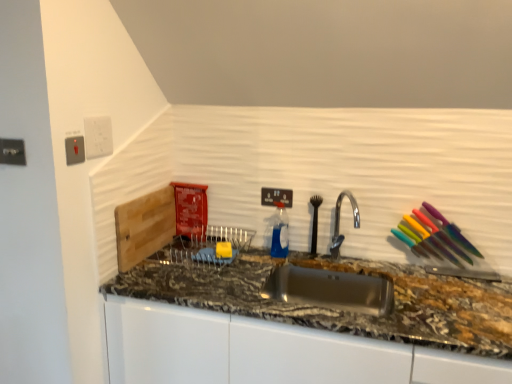
Question: Looking at the image, does satin silver switch at upper left, placed as the third electric outlet when sorted from right to left, seem bigger or smaller compared to white plastic electric outlet at upper left, which is the 3th electric outlet in left-to-right order?

Choices:
 (A) small
 (B) big

Answer: (A)

Question: Would you say satin silver switch at upper left, the 2th electric outlet from the front, is to the left or to the right of white plastic electric outlet at upper left, which is the 3th electric outlet in left-to-right order, in the picture?

Choices:
 (A) left
 (B) right

Answer: (A)

Question: Which object is the closest to the black plastic electric outlet at upper center, which appears as the fourth electric outlet when viewed from the front?

Choices:
 (A) white plastic electric outlet at upper left, the 3th electric outlet when ordered from front to back
 (B) metallic silver outlet at upper left, the fourth electric outlet positioned from the right
 (C) satin silver switch at upper left, the 2th electric outlet when ordered from left to right
 (D) granite at center
 (E) silver metallic faucet at center

Answer: (E)

Question: Which object is positioned closest to the metallic silver outlet at upper left, the first electric outlet from the left?

Choices:
 (A) silver metallic faucet at center
 (B) granite at center
 (C) black plastic electric outlet at upper center, which appears as the first electric outlet when viewed from the back
 (D) satin silver switch at upper left, placed as the third electric outlet when sorted from right to left
 (E) white plastic electric outlet at upper left, the 3th electric outlet when ordered from front to back

Answer: (D)